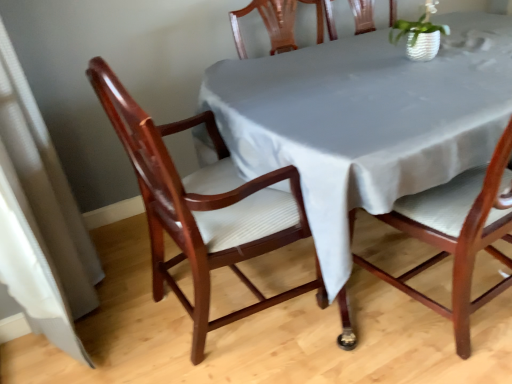
Question: Is mahogany wood chair at center, the second chair when ordered from left to right, to the right of smooth gray tablecloth at center from the viewer's perspective?

Choices:
 (A) no
 (B) yes

Answer: (A)

Question: Is mahogany wood chair at center, which is the 1th chair in right-to-left order, aimed at smooth gray tablecloth at center?

Choices:
 (A) yes
 (B) no

Answer: (A)

Question: From the image's perspective, is mahogany wood chair at center, which is the 1th chair in right-to-left order, on smooth gray tablecloth at center?

Choices:
 (A) yes
 (B) no

Answer: (B)

Question: Is mahogany wood chair at center, which is the 1th chair in right-to-left order, surrounding smooth gray tablecloth at center?

Choices:
 (A) yes
 (B) no

Answer: (B)

Question: Is mahogany wood chair at center, the second chair when ordered from left to right, positioned beyond the bounds of smooth gray tablecloth at center?

Choices:
 (A) yes
 (B) no

Answer: (B)

Question: Does mahogany wood chair at center, which is the 1th chair in right-to-left order, come in front of smooth gray tablecloth at center?

Choices:
 (A) no
 (B) yes

Answer: (B)

Question: Is smooth gray tablecloth at center behind white textured pot at upper right?

Choices:
 (A) no
 (B) yes

Answer: (A)

Question: Can you confirm if smooth gray tablecloth at center is shorter than white textured pot at upper right?

Choices:
 (A) yes
 (B) no

Answer: (B)

Question: Does smooth gray tablecloth at center have a lesser width compared to white textured pot at upper right?

Choices:
 (A) yes
 (B) no

Answer: (B)

Question: Is smooth gray tablecloth at center beside white textured pot at upper right?

Choices:
 (A) yes
 (B) no

Answer: (B)

Question: Is smooth gray tablecloth at center positioned before white textured pot at upper right?

Choices:
 (A) no
 (B) yes

Answer: (B)

Question: Is smooth gray tablecloth at center at the right side of white textured pot at upper right?

Choices:
 (A) no
 (B) yes

Answer: (B)

Question: From a real-world perspective, is mahogany wood chair at center, which is the 1th chair in right-to-left order, positioned under white textured pot at upper right based on gravity?

Choices:
 (A) no
 (B) yes

Answer: (B)